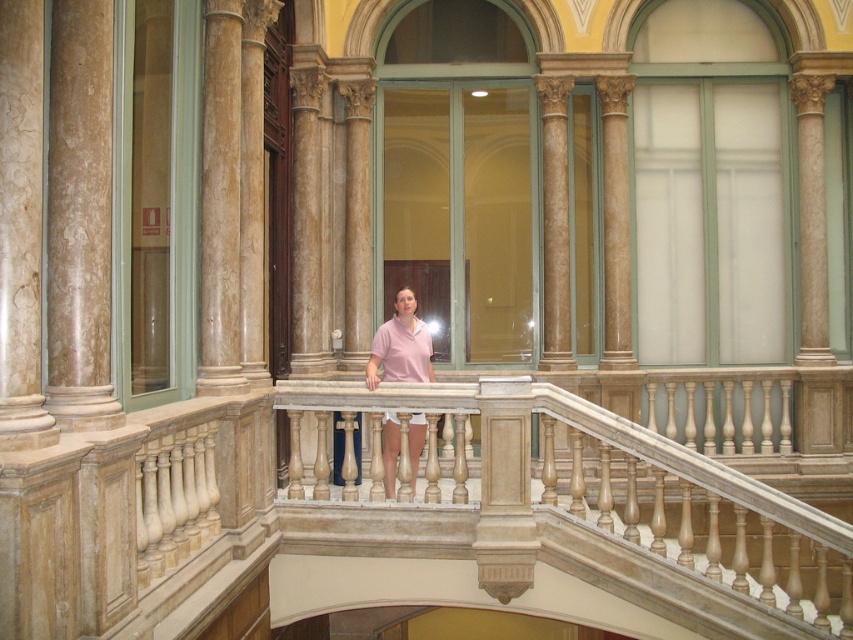
From the picture: Who is positioned more to the left, beige marble balustrade at center or pink matte shirt at center?

pink matte shirt at center

Between point (782, 538) and point (410, 369), which one is positioned behind?

The point (782, 538) is behind.

The width and height of the screenshot is (853, 640). Find the location of `beige marble balustrade at center`. beige marble balustrade at center is located at coordinates pyautogui.click(x=579, y=502).